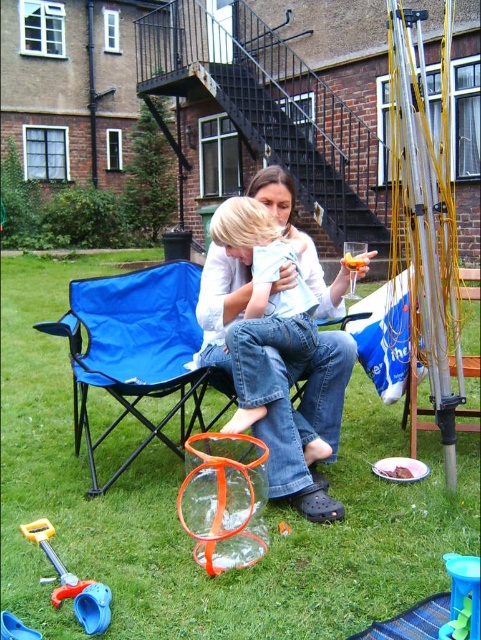
Question: Which object is positioned farthest from the denim jeans at center?

Choices:
 (A) translucent plastic cup at lower right
 (B) brown crumbly cake at lower center

Answer: (A)

Question: Is denim jeans at center bigger than orange translucent plastic cup at upper center?

Choices:
 (A) yes
 (B) no

Answer: (A)

Question: Which object is closer to the camera taking this photo?

Choices:
 (A) blue plastic toy at lower left
 (B) translucent plastic cup at lower right
 (C) denim jeans at center

Answer: (B)

Question: Which object is the closest to the brown crumbly cake at lower center?

Choices:
 (A) green grass at lower center
 (B) blue plastic toy at lower left
 (C) blue fabric chair at left

Answer: (C)

Question: Does green grass at lower center appear on the right side of blue plastic toy at lower left?

Choices:
 (A) yes
 (B) no

Answer: (B)

Question: Can you confirm if denim jeans at center is smaller than brown crumbly cake at lower center?

Choices:
 (A) yes
 (B) no

Answer: (B)